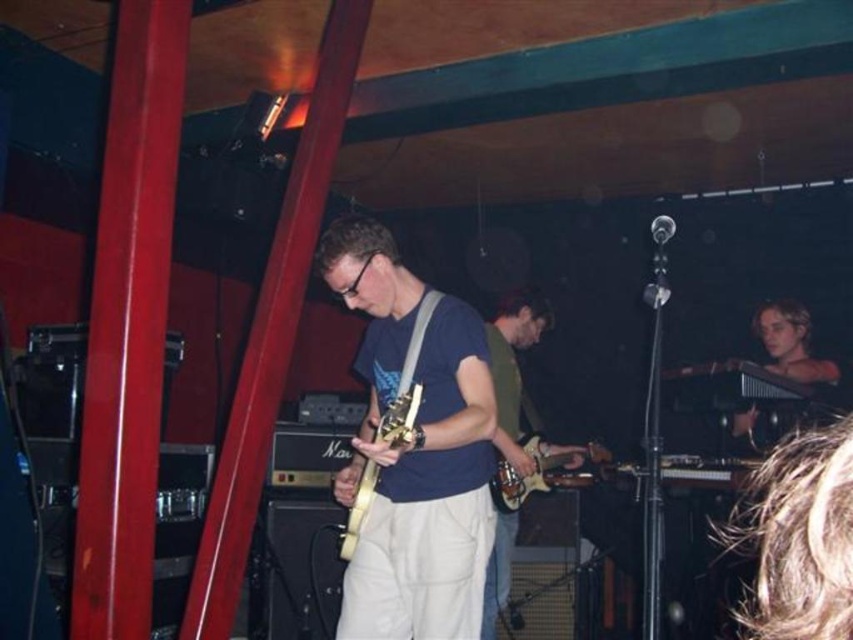
Looking at this image, you are standing at the front of the venue and want to take a photo of the point marked at coordinates point [738,419]. If your camera has a maximum focus range of 12 feet, will you be able to capture the point clearly?

The distance of point [738,419] from the camera is 13.03 feet, which exceeds the camera maximum focus range of 12 feet. Therefore, you will not be able to capture the point clearly.

You are a photographer at the back of the venue and want to capture both the light brown wooden harp at right and the wooden electric guitar at center in a single shot. Which instrument should you adjust your camera angle upwards to include?

You should adjust your camera angle upwards to include the light brown wooden harp at right because it is located above the wooden electric guitar at center.